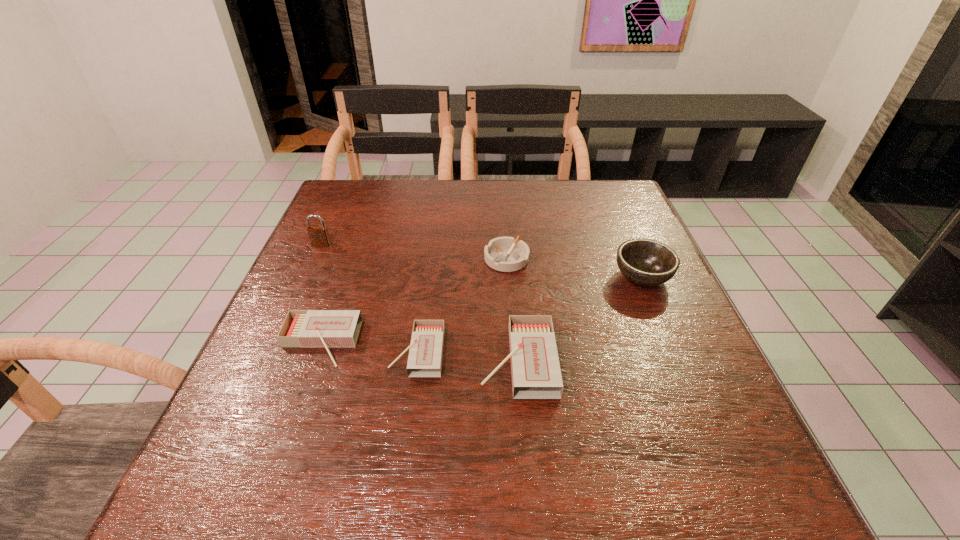
Where is `the leftmost matchbox`? The image size is (960, 540). the leftmost matchbox is located at coordinates pyautogui.click(x=301, y=328).

Locate an element on the screen. the third shortest object is located at coordinates 301,328.

Find the location of `the second matchbox from right to left`. the second matchbox from right to left is located at coordinates (426, 348).

Identify the location of the shortest matchbox. (426, 348).

You are a GUI agent. You are given a task and a screenshot of the screen. Output one action in this format:
    pyautogui.click(x=<x>, y=<y>)
    Task: Click on the rightmost matchbox
    
    Given the screenshot: What is the action you would take?
    pyautogui.click(x=535, y=368)

I want to click on bowl, so click(646, 262).

Where is `the fifth shortest object`? This screenshot has width=960, height=540. the fifth shortest object is located at coordinates (x=646, y=262).

Locate an element on the screen. The image size is (960, 540). the tallest object is located at coordinates (319, 237).

You are a GUI agent. You are given a task and a screenshot of the screen. Output one action in this format:
    pyautogui.click(x=<x>, y=<y>)
    Task: Click on the shortest object
    This screenshot has height=540, width=960.
    Given the screenshot: What is the action you would take?
    pyautogui.click(x=505, y=254)

Identify the location of free space located on the striking surface of the leftmost matchbox. The width and height of the screenshot is (960, 540). (297, 408).